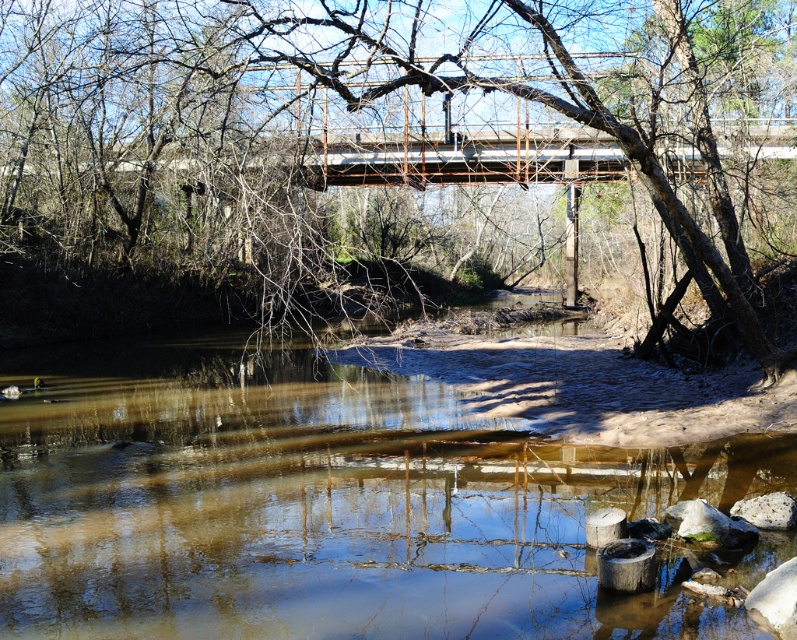
Question: Which point appears closest to the camera in this image?

Choices:
 (A) (760, 35)
 (B) (171, 486)

Answer: (B)

Question: Which object appears closest to the camera in this image?

Choices:
 (A) brown rough tree at upper center
 (B) brown sedimentary river at center

Answer: (B)

Question: Can you confirm if brown rough tree at upper center is positioned above brown sedimentary river at center?

Choices:
 (A) no
 (B) yes

Answer: (B)

Question: Does brown rough tree at upper center have a smaller size compared to brown sedimentary river at center?

Choices:
 (A) no
 (B) yes

Answer: (A)

Question: Is brown rough tree at upper center above brown sedimentary river at center?

Choices:
 (A) yes
 (B) no

Answer: (A)